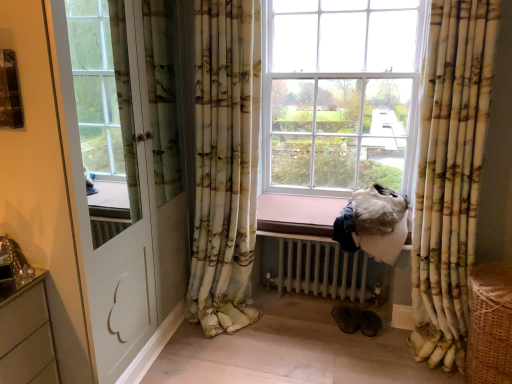
Question: Considering the relative sizes of white glossy door at left and floral fabric curtain at center, arranged as the 1th curtain when viewed from the left, in the image provided, is white glossy door at left wider than floral fabric curtain at center, arranged as the 1th curtain when viewed from the left,?

Choices:
 (A) no
 (B) yes

Answer: (B)

Question: From the image's perspective, is white glossy door at left beneath floral fabric curtain at center, acting as the second curtain starting from the right?

Choices:
 (A) yes
 (B) no

Answer: (A)

Question: From a real-world perspective, does white glossy door at left sit lower than floral fabric curtain at center, arranged as the 1th curtain when viewed from the left?

Choices:
 (A) no
 (B) yes

Answer: (A)

Question: Can you confirm if white glossy door at left is positioned to the left of floral fabric curtain at center, arranged as the 1th curtain when viewed from the left?

Choices:
 (A) yes
 (B) no

Answer: (A)

Question: Would you consider white glossy door at left to be distant from floral fabric curtain at center, acting as the second curtain starting from the right?

Choices:
 (A) yes
 (B) no

Answer: (B)

Question: Can we say white glossy door at left lies outside floral fabric curtain at center, arranged as the 1th curtain when viewed from the left?

Choices:
 (A) yes
 (B) no

Answer: (A)

Question: From the image's perspective, is floral fabric curtain at right, the second curtain in the left-to-right sequence, under brown woven basket at lower right?

Choices:
 (A) yes
 (B) no

Answer: (B)

Question: Considering the relative positions of floral fabric curtain at right, the second curtain in the left-to-right sequence, and brown woven basket at lower right in the image provided, is floral fabric curtain at right, the second curtain in the left-to-right sequence, to the left of brown woven basket at lower right from the viewer's perspective?

Choices:
 (A) yes
 (B) no

Answer: (A)

Question: Can you confirm if floral fabric curtain at right, the second curtain in the left-to-right sequence, is positioned to the right of brown woven basket at lower right?

Choices:
 (A) yes
 (B) no

Answer: (B)

Question: Is floral fabric curtain at right, the second curtain in the left-to-right sequence, outside of brown woven basket at lower right?

Choices:
 (A) no
 (B) yes

Answer: (B)

Question: From a real-world perspective, is floral fabric curtain at right, the second curtain in the left-to-right sequence, positioned over brown woven basket at lower right based on gravity?

Choices:
 (A) yes
 (B) no

Answer: (A)

Question: Considering the relative sizes of floral fabric curtain at right, which is counted as the 1th curtain, starting from the right, and brown woven basket at lower right in the image provided, is floral fabric curtain at right, which is counted as the 1th curtain, starting from the right, thinner than brown woven basket at lower right?

Choices:
 (A) no
 (B) yes

Answer: (B)

Question: Is floral fabric curtain at center, acting as the second curtain starting from the right, aimed at white glossy door at left?

Choices:
 (A) no
 (B) yes

Answer: (A)